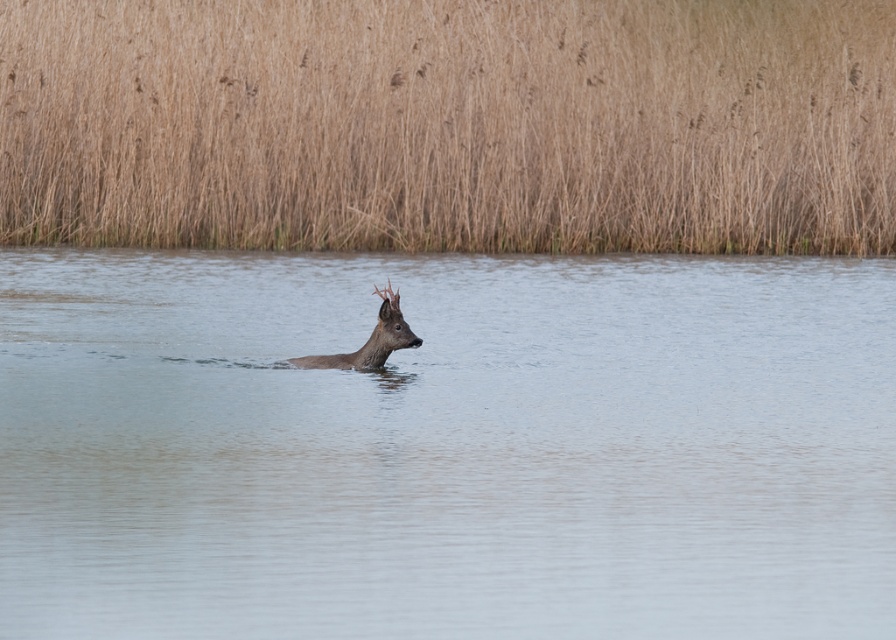
Does brown grass at upper center appear on the right side of brown matte deer at center?

Indeed, brown grass at upper center is positioned on the right side of brown matte deer at center.

What do you see at coordinates (450, 125) in the screenshot? This screenshot has height=640, width=896. I see `brown grass at upper center` at bounding box center [450, 125].

I want to click on brown grass at upper center, so click(450, 125).

Which is below, clear water at center or brown matte deer at center?

brown matte deer at center is below.

This screenshot has height=640, width=896. What do you see at coordinates (446, 445) in the screenshot? I see `clear water at center` at bounding box center [446, 445].

Where is `clear water at center`? clear water at center is located at coordinates (446, 445).

Can you confirm if clear water at center is taller than brown grass at upper center?

Incorrect, clear water at center's height is not larger of brown grass at upper center's.

Who is more distant from viewer, (461, 618) or (429, 129)?

Point (429, 129)

Who is more forward, (88, 627) or (730, 68)?

Point (88, 627) is in front.

I want to click on clear water at center, so click(446, 445).